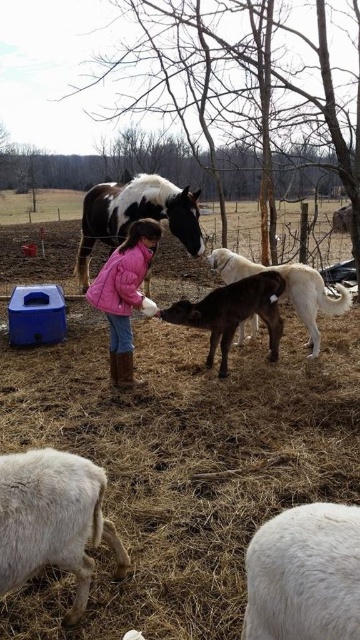
How much distance is there between smooth brown calf at center and brown glossy pony at center?

smooth brown calf at center and brown glossy pony at center are 1.33 meters apart from each other.

What do you see at coordinates (181, 461) in the screenshot? The height and width of the screenshot is (640, 360). I see `smooth brown calf at center` at bounding box center [181, 461].

What are the coordinates of `smooth brown calf at center` in the screenshot? It's located at (181, 461).

Who is shorter, spotted glossy horse at center or brown glossy pony at center?

Answer: spotted glossy horse at center

Describe the element at coordinates (136, 216) in the screenshot. I see `spotted glossy horse at center` at that location.

Does point (127, 195) lie behind point (303, 291)?

Yes.

Where is `spotted glossy horse at center`? The image size is (360, 640). spotted glossy horse at center is located at coordinates (136, 216).

Between black smooth calf at center and brown glossy pony at center, which one has less height?

With less height is black smooth calf at center.

Who is positioned more to the right, black smooth calf at center or brown glossy pony at center?

brown glossy pony at center

Is point (213, 348) positioned after point (239, 275)?

No, (213, 348) is closer to viewer.

Where is `black smooth calf at center`? The height and width of the screenshot is (640, 360). black smooth calf at center is located at coordinates (232, 312).